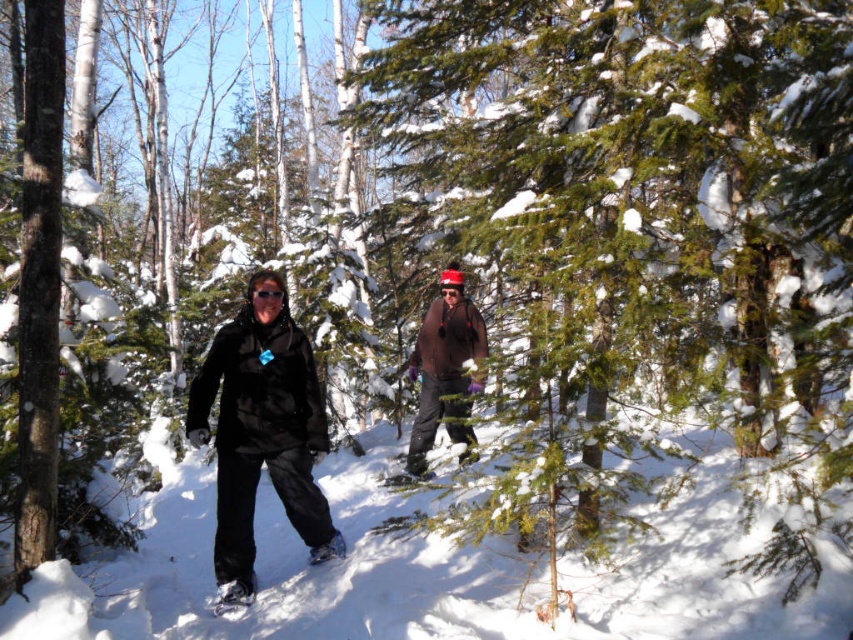
Between point (236, 616) and point (332, 556), which one is positioned in front?

Positioned in front is point (236, 616).

Can you confirm if white rubber snowshoe at lower left is bigger than black rubber snowshoe at lower center?

Correct, white rubber snowshoe at lower left is larger in size than black rubber snowshoe at lower center.

You are a GUI agent. You are given a task and a screenshot of the screen. Output one action in this format:
    pyautogui.click(x=<x>, y=<y>)
    Task: Click on the white rubber snowshoe at lower left
    This screenshot has width=853, height=640.
    Given the screenshot: What is the action you would take?
    pyautogui.click(x=233, y=596)

Is brown matte jacket at center thinner than black rubber snowshoe at lower center?

Incorrect, brown matte jacket at center's width is not less than black rubber snowshoe at lower center's.

Between point (474, 348) and point (312, 547), which one is positioned behind?

The point (474, 348) is behind.

Who is more forward, (457, 301) or (316, 552)?

Point (316, 552) is in front.

Find the location of a particular element. brown matte jacket at center is located at coordinates (445, 369).

Is black matte snowshoes at center positioned behind black rubber snowshoe at lower center?

No, black matte snowshoes at center is closer to the viewer.

Between point (200, 436) and point (341, 538), which one is positioned in front?

Positioned in front is point (200, 436).

Where is `black matte snowshoes at center`? black matte snowshoes at center is located at coordinates (260, 422).